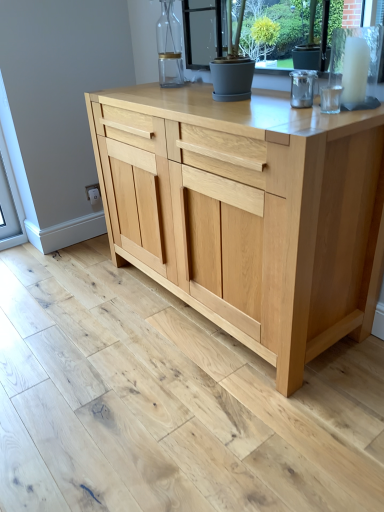
This screenshot has height=512, width=384. Describe the element at coordinates (248, 212) in the screenshot. I see `natural wood cabinet at center` at that location.

The height and width of the screenshot is (512, 384). I want to click on natural wood cabinet at center, so click(x=248, y=212).

This screenshot has width=384, height=512. Find the location of `natural wood cabinet at center`. natural wood cabinet at center is located at coordinates (248, 212).